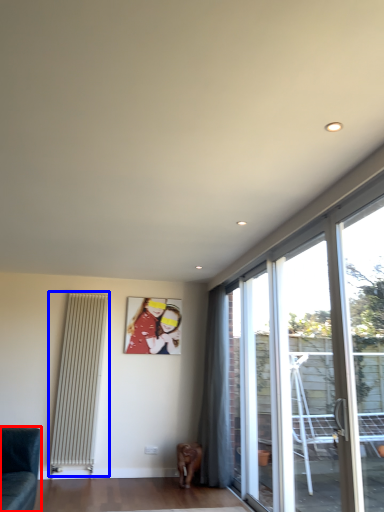
Question: Which point is further to the camera, studio couch (highlighted by a red box) or radiator (highlighted by a blue box)?

Choices:
 (A) studio couch
 (B) radiator

Answer: (B)